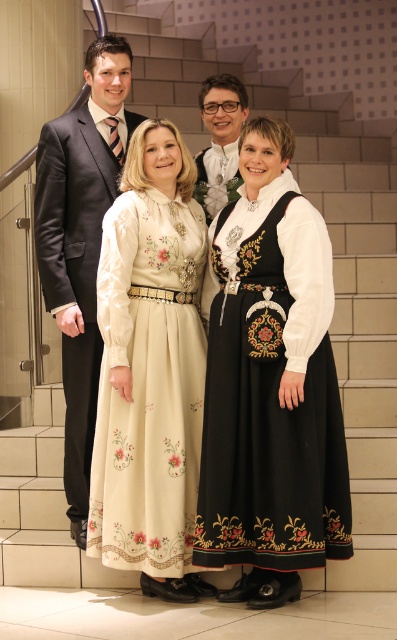
Find the location of a particular element. embroidered silk dress at center is located at coordinates [x=273, y=432].

Is embroidered silk dress at center further to the viewer compared to black satin dress at center?

No, it is in front of black satin dress at center.

Is point (256, 260) positioned after point (242, 256)?

No, (256, 260) is closer to viewer.

The height and width of the screenshot is (640, 397). What are the coordinates of `embroidered silk dress at center` in the screenshot? It's located at (273, 432).

Who is lower down, cream satin dress at center or matte white shirt at center?

Positioned lower is cream satin dress at center.

Is the position of cream satin dress at center less distant than that of matte white shirt at center?

Yes, cream satin dress at center is in front of matte white shirt at center.

At what (x,y) coordinates should I click in order to perform the action: click on cream satin dress at center. Please return your answer as a coordinate pair (x, y). Looking at the image, I should click on (148, 385).

This screenshot has width=397, height=640. Identify the location of cream satin dress at center. (148, 385).

Is embroidered silk dress at center positioned in front of matte black suit at left?

Yes, embroidered silk dress at center is closer to the viewer.

Which is below, embroidered silk dress at center or matte black suit at left?

embroidered silk dress at center is lower down.

Who is more distant from viewer, (317, 388) or (79, 346)?

The point (79, 346) is behind.

Where is `embroidered silk dress at center`? This screenshot has width=397, height=640. embroidered silk dress at center is located at coordinates (273, 432).